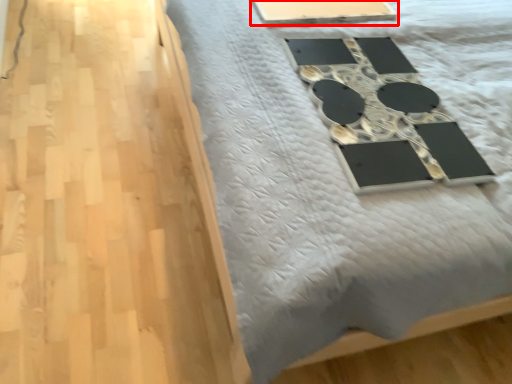
Question: Considering the relative positions of table (annotated by the red box) and furniture in the image provided, where is table (annotated by the red box) located with respect to the staircase?

Choices:
 (A) left
 (B) right

Answer: (B)